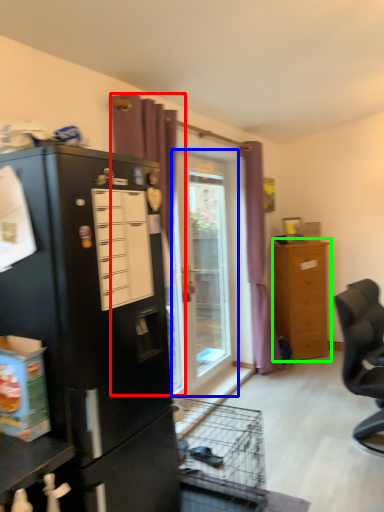
Question: Which is farther away from curtain (highlighted by a red box)? door (highlighted by a blue box) or chest of drawers (highlighted by a green box)?

Choices:
 (A) door
 (B) chest of drawers

Answer: (B)